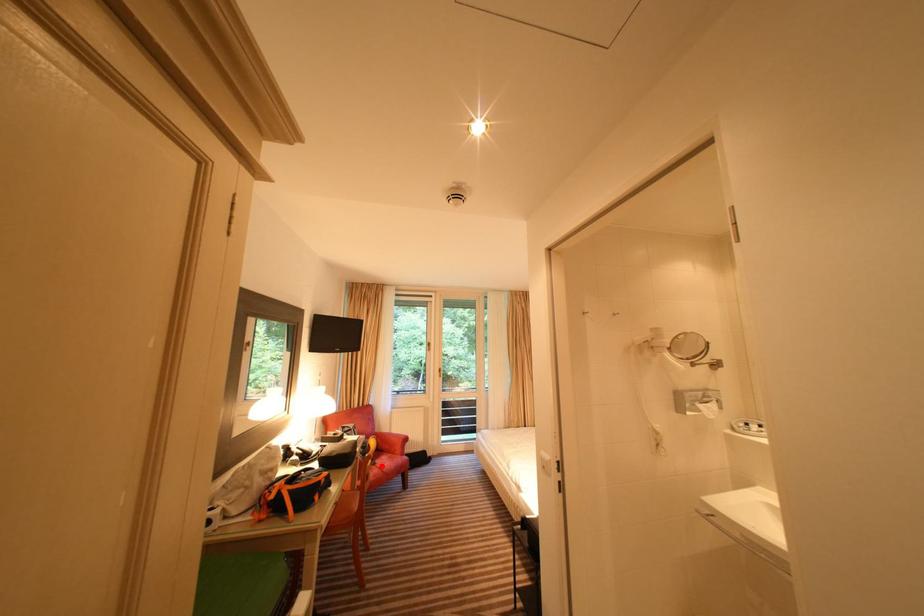
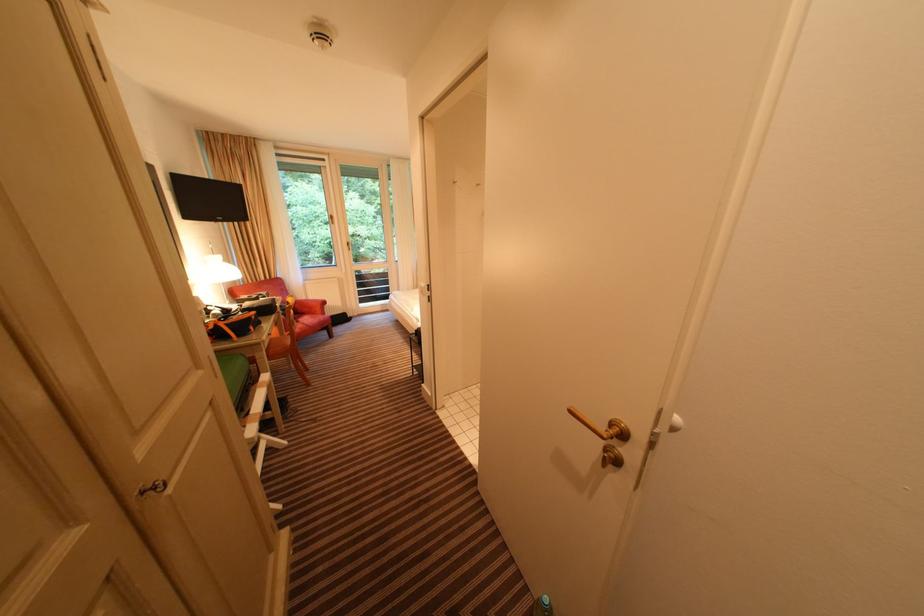
Question: I am providing you with two images of the same scene from different viewpoints. Image1 has a red point marked. In image2, the corresponding 3D location appears at what relative position? Reply with the corresponding letter.

Choices:
 (A) Closer
 (B) Farther

Answer: (A)